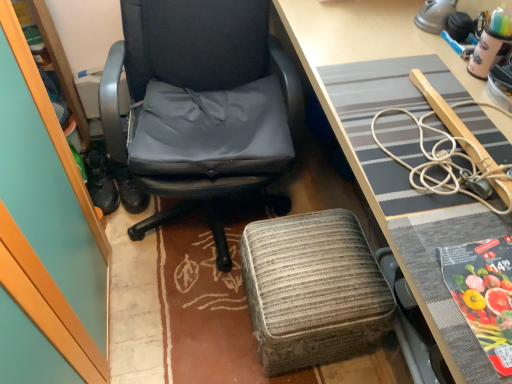
Question: From the image's perspective, is woven fabric stool at lower center positioned above or below black rubber shoes at left?

Choices:
 (A) below
 (B) above

Answer: (A)

Question: Is point (250, 263) closer or farther from the camera than point (94, 165)?

Choices:
 (A) closer
 (B) farther

Answer: (A)

Question: Based on their relative distances, which object is nearer to the printed paper at lower right?

Choices:
 (A) woven fabric stool at lower center
 (B) textured gray desk mat at center
 (C) black rubber shoes at left
 (D) matte black office chair at center

Answer: (B)

Question: Which object is positioned closest to the matte black office chair at center?

Choices:
 (A) woven fabric stool at lower center
 (B) printed paper at lower right
 (C) textured gray desk mat at center
 (D) black rubber shoes at left

Answer: (C)